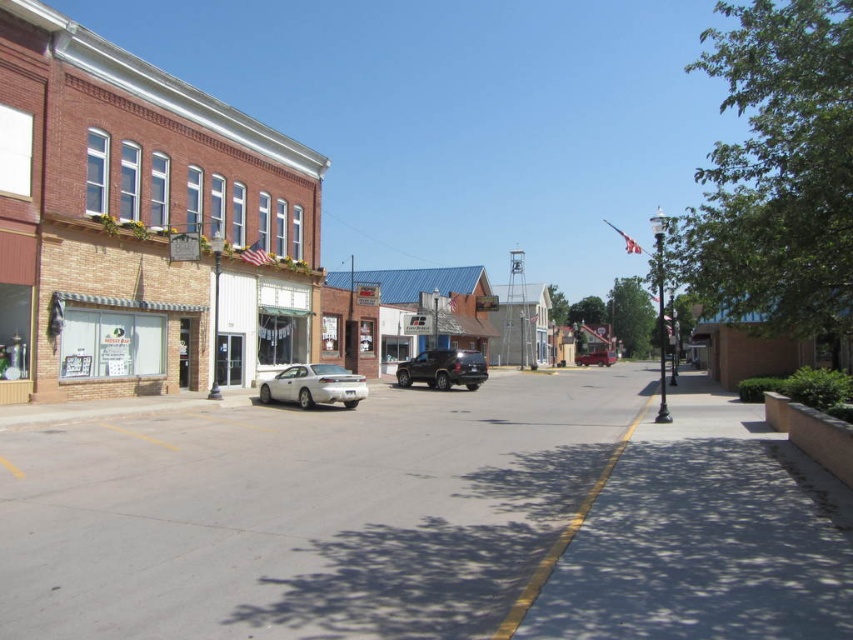
Consider the image. You are a pedestrian standing on the sidewalk and want to cross the street to reach the building with the American flag. There is a satin silver sedan at center and a matte black truck at center in your path. Which vehicle should you avoid first?

You should avoid the satin silver sedan at center first because it is closer to the viewer than the matte black truck at center.

You are a delivery person trying to park your 2.5 meters wide van in this street. There is a satin silver sedan at center and a matte black truck at center in the way. Which vehicle should you move to make space for your van?

The satin silver sedan at center has a lesser width compared to matte black truck at center, so you should move the satin silver sedan at center to make more space for your van.